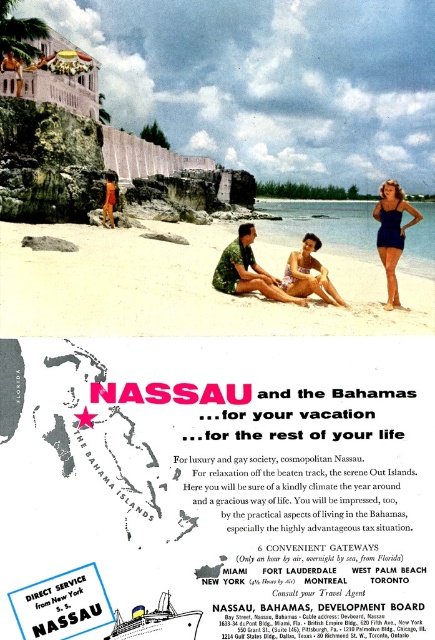
Question: Which object is farther from the camera taking this photo?

Choices:
 (A) white glossy ship at lower center
 (B) matte green shirt at center
 (C) orange swimsuit at center

Answer: (C)

Question: Considering the real-world distances, which object is closest to the matte green shirt at center?

Choices:
 (A) orange swimsuit at center
 (B) white glossy ship at lower center

Answer: (A)

Question: Where is matte green shirt at center located in relation to orange swimsuit at center in the image?

Choices:
 (A) above
 (B) below

Answer: (B)

Question: Which point is closer to the camera taking this photo?

Choices:
 (A) (236, 243)
 (B) (397, 307)
 (C) (107, 636)

Answer: (C)

Question: Does beige fabric bikini at center appear on the left side of orange swimsuit at center?

Choices:
 (A) no
 (B) yes

Answer: (A)

Question: Can you confirm if matte blue swimsuit at right is positioned below white glossy ship at lower center?

Choices:
 (A) yes
 (B) no

Answer: (B)